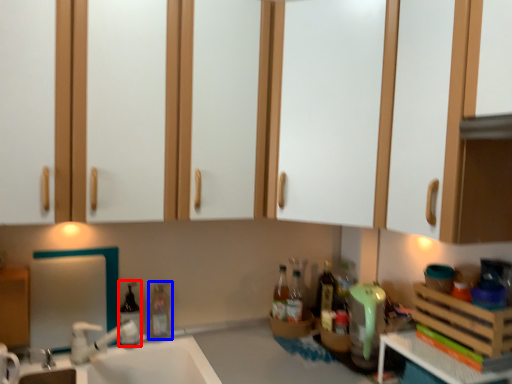
Question: Which of the following is the farthest to the observer, bottle (highlighted by a red box) or bottle (highlighted by a blue box)?

Choices:
 (A) bottle
 (B) bottle

Answer: (B)